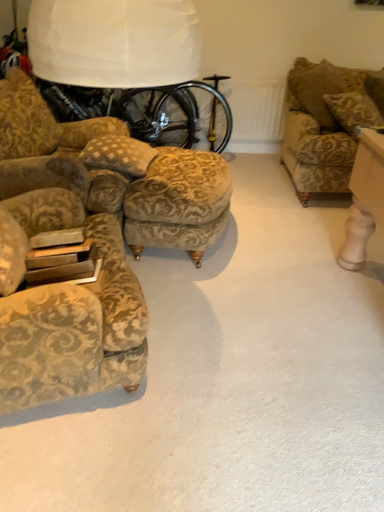
Image resolution: width=384 pixels, height=512 pixels. What are the coordinates of `patterned fabric pillow at center` in the screenshot? It's located at (118, 154).

Where is `velvet floral armchair at left`? velvet floral armchair at left is located at coordinates (72, 318).

Image resolution: width=384 pixels, height=512 pixels. I want to click on white fabric lampshade at upper center, so click(x=114, y=42).

Considering the sizes of white fabric lampshade at upper center and velvet floral armchair at left in the image, is white fabric lampshade at upper center taller or shorter than velvet floral armchair at left?

In the image, white fabric lampshade at upper center appears to be taller than velvet floral armchair at left.

From the picture: Could you tell me if white fabric lampshade at upper center is turned towards velvet floral armchair at left?

Yes, white fabric lampshade at upper center faces towards velvet floral armchair at left.

Which object is further away from the camera, white fabric lampshade at upper center or velvet floral armchair at left?

white fabric lampshade at upper center is more distant.

Is gold-patterned fabric couch at upper right oriented away from gold-patterned fabric stool at center?

That's not correct — gold-patterned fabric couch at upper right is not looking away from gold-patterned fabric stool at center.

Considering the sizes of objects gold-patterned fabric couch at upper right and gold-patterned fabric stool at center in the image provided, who is taller, gold-patterned fabric couch at upper right or gold-patterned fabric stool at center?

gold-patterned fabric couch at upper right is taller.

Can you confirm if gold-patterned fabric couch at upper right is bigger than gold-patterned fabric stool at center?

No, gold-patterned fabric couch at upper right is not bigger than gold-patterned fabric stool at center.

Would you say gold-patterned fabric couch at upper right is inside or outside gold-patterned fabric stool at center?

gold-patterned fabric couch at upper right lies outside gold-patterned fabric stool at center.

From the image's perspective, would you say patterned fabric pillow at center is shown under white fabric lampshade at upper center?

Correct, patterned fabric pillow at center appears lower than white fabric lampshade at upper center in the image.

Is patterned fabric pillow at center situated inside white fabric lampshade at upper center or outside?

patterned fabric pillow at center is located beyond the bounds of white fabric lampshade at upper center.

Who is shorter, patterned fabric pillow at center or white fabric lampshade at upper center?

patterned fabric pillow at center is shorter.

Is gold-patterned fabric stool at center in front of gold-patterned fabric couch at upper right?

Yes, gold-patterned fabric stool at center is closer to the viewer.

Between gold-patterned fabric stool at center and gold-patterned fabric couch at upper right, which one has less height?

With less height is gold-patterned fabric stool at center.

Is gold-patterned fabric stool at center next to gold-patterned fabric couch at upper right?

There is a gap between gold-patterned fabric stool at center and gold-patterned fabric couch at upper right.

Which is correct: gold-patterned fabric stool at center is inside gold-patterned fabric couch at upper right, or outside of it?

The correct answer is: outside.

From the image's perspective, who appears lower, white fabric lampshade at upper center or gold-patterned fabric couch at upper right?

gold-patterned fabric couch at upper right.

Who is more distant, white fabric lampshade at upper center or gold-patterned fabric couch at upper right?

Positioned behind is white fabric lampshade at upper center.

Who is bigger, white fabric lampshade at upper center or gold-patterned fabric couch at upper right?

white fabric lampshade at upper center is bigger.

Can gold-patterned fabric couch at upper right be found inside white fabric lampshade at upper center?

No, gold-patterned fabric couch at upper right is not inside white fabric lampshade at upper center.

From a real-world perspective, is gold-patterned fabric stool at center physically located above or below patterned fabric pillow at center?

From a real-world perspective, gold-patterned fabric stool at center is physically below patterned fabric pillow at center.

Is gold-patterned fabric stool at center completely or partially outside of patterned fabric pillow at center?

gold-patterned fabric stool at center is positioned outside patterned fabric pillow at center.

Is point (151, 164) closer to camera compared to point (135, 162)?

No, (151, 164) is behind (135, 162).

Based on the photo, how distant is gold-patterned fabric stool at center from patterned fabric pillow at center?

gold-patterned fabric stool at center is 10.48 inches from patterned fabric pillow at center.

Could patterned fabric pillow at center be considered to be inside gold-patterned fabric couch at upper right?

No, patterned fabric pillow at center is not inside gold-patterned fabric couch at upper right.

Which object is positioned more to the right, gold-patterned fabric couch at upper right or patterned fabric pillow at center?

gold-patterned fabric couch at upper right.

Considering the relative sizes of gold-patterned fabric couch at upper right and patterned fabric pillow at center in the image provided, is gold-patterned fabric couch at upper right bigger than patterned fabric pillow at center?

Correct, gold-patterned fabric couch at upper right is larger in size than patterned fabric pillow at center.

This screenshot has height=512, width=384. In order to click on chair located underneath the white fabric lampshade at upper center (from a real-world perspective) in this screenshot , I will do `click(72, 318)`.

What are the coordinates of `stool in front of the gold-patterned fabric couch at upper right` in the screenshot? It's located at (178, 202).

Which object lies nearer to the anchor point gold-patterned fabric couch at upper right, patterned fabric pillow at center or white fabric lampshade at upper center?

Based on the image, patterned fabric pillow at center appears to be nearer to gold-patterned fabric couch at upper right.

Which object lies further to the anchor point white fabric lampshade at upper center, patterned fabric pillow at center or velvet floral armchair at left?

patterned fabric pillow at center is further to white fabric lampshade at upper center.

Based on their spatial positions, is patterned fabric pillow at center or gold-patterned fabric stool at center closer to velvet floral armchair at left?

Based on the image, gold-patterned fabric stool at center appears to be nearer to velvet floral armchair at left.

In the scene shown: From the image, which object appears to be farther from patterned fabric pillow at center, gold-patterned fabric stool at center or velvet floral armchair at left?

Among the two, velvet floral armchair at left is located further to patterned fabric pillow at center.

From the image, which object appears to be farther from gold-patterned fabric stool at center, gold-patterned fabric couch at upper right or patterned fabric pillow at center?

gold-patterned fabric couch at upper right is positioned further to the anchor gold-patterned fabric stool at center.

Consider the image. Based on their spatial positions, is patterned fabric pillow at center or gold-patterned fabric couch at upper right closer to white fabric lampshade at upper center?

Based on the image, patterned fabric pillow at center appears to be nearer to white fabric lampshade at upper center.

When comparing their distances from white fabric lampshade at upper center, does gold-patterned fabric stool at center or patterned fabric pillow at center seem closer?

Among the two, patterned fabric pillow at center is located nearer to white fabric lampshade at upper center.

Looking at the image, which one is located further to white fabric lampshade at upper center, gold-patterned fabric stool at center or gold-patterned fabric couch at upper right?

gold-patterned fabric couch at upper right is further to white fabric lampshade at upper center.

Identify the location of pillow between white fabric lampshade at upper center and gold-patterned fabric stool at center in the up-down direction. (118, 154).

What are the coordinates of `pillow between velvet floral armchair at left and gold-patterned fabric couch at upper right from left to right` in the screenshot? It's located at (118, 154).

In order to click on pillow located between white fabric lampshade at upper center and gold-patterned fabric couch at upper right in the left-right direction in this screenshot , I will do `click(118, 154)`.

The width and height of the screenshot is (384, 512). Find the location of `stool between velvet floral armchair at left and gold-patterned fabric couch at upper right`. stool between velvet floral armchair at left and gold-patterned fabric couch at upper right is located at coordinates (178, 202).